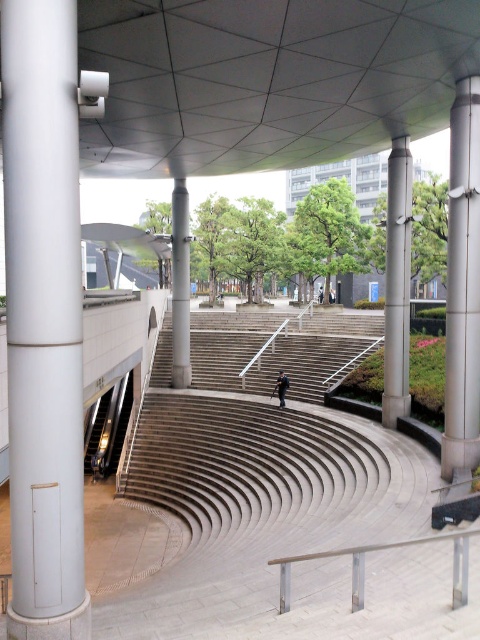
Question: Observing the image, what is the correct spatial positioning of satin silver pole at right in reference to satin silver pole at center right?

Choices:
 (A) below
 (B) above

Answer: (A)

Question: Does smooth concrete stairs at center appear on the left side of satin silver pole at right?

Choices:
 (A) no
 (B) yes

Answer: (B)

Question: Which is nearer to the satin silver column at center?

Choices:
 (A) white glossy column at left
 (B) silver metallic rail at lower center
 (C) dark blue matte skateboard at center

Answer: (C)

Question: Estimate the real-world distances between objects in this image. Which object is closer to the white glossy column at left?

Choices:
 (A) satin silver column at center
 (B) silver metallic rail at lower center
 (C) smooth concrete stairs at center

Answer: (B)

Question: Can you confirm if smooth concrete stairs at center is positioned above satin silver column at center?

Choices:
 (A) no
 (B) yes

Answer: (A)

Question: Which point is closer to the camera?

Choices:
 (A) smooth concrete stairs at center
 (B) satin silver column at center
 (C) satin silver pole at right

Answer: (C)